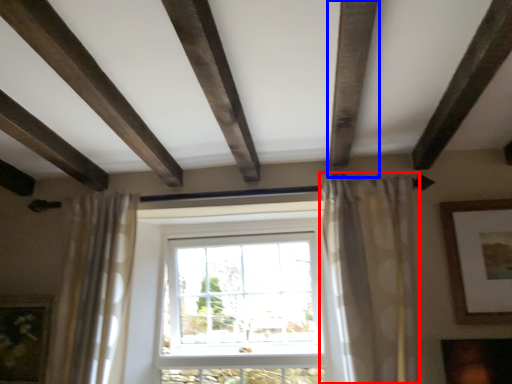
Question: Which object is further to the camera taking this photo, curtain (highlighted by a red box) or plank (highlighted by a blue box)?

Choices:
 (A) curtain
 (B) plank

Answer: (A)